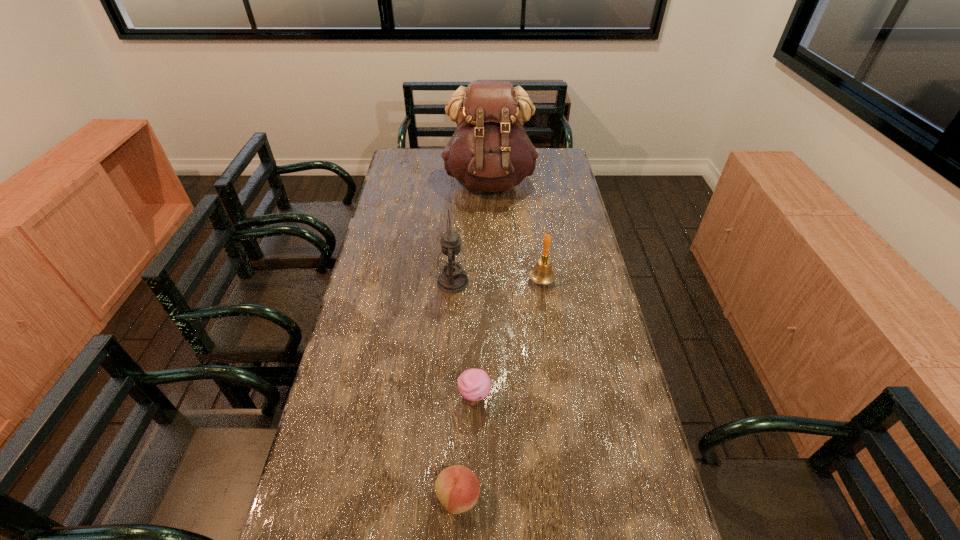
This screenshot has height=540, width=960. In order to click on free space located on the right of the nearest object in this screenshot , I will do `click(581, 497)`.

This screenshot has height=540, width=960. In order to click on object located at the far edge in this screenshot , I will do `click(490, 151)`.

Where is `satchel located at the right edge`? The width and height of the screenshot is (960, 540). satchel located at the right edge is located at coordinates (490, 151).

Find the location of a particular element. bell that is positioned at the right edge is located at coordinates (542, 273).

Locate an element on the screen. object located at the far right corner is located at coordinates (490, 151).

Identify the location of vacant region at the far edge of the desktop. (441, 164).

You are a GUI agent. You are given a task and a screenshot of the screen. Output one action in this format:
    pyautogui.click(x=<x>, y=<y>)
    Task: Click on the vacant space at the left edge of the desktop
    This screenshot has width=960, height=540.
    Given the screenshot: What is the action you would take?
    pyautogui.click(x=380, y=236)

I want to click on blank space at the right edge of the desktop, so 554,291.

The image size is (960, 540). I want to click on free point between the farthest object and the peach, so click(x=473, y=339).

Image resolution: width=960 pixels, height=540 pixels. I want to click on free area in between the fourth farthest object and the nearest object, so click(467, 448).